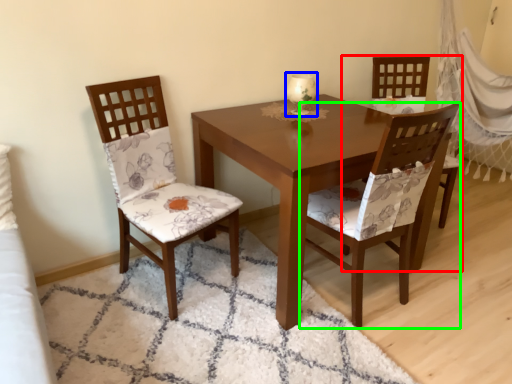
Question: Considering the real-world distances, which object is closest to chair (highlighted by a red box)? candle holder (highlighted by a blue box) or chair (highlighted by a green box).

Choices:
 (A) candle holder
 (B) chair

Answer: (B)